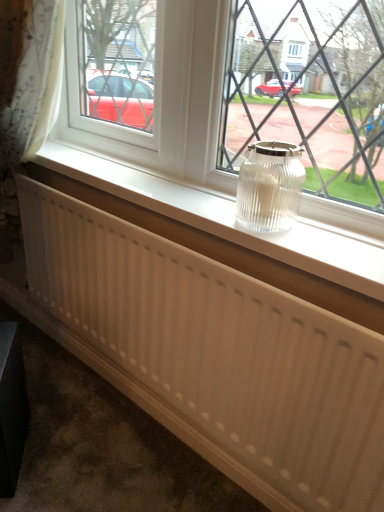
Locate an element on the screen. vacant space situated above white plastic radiator at center (from a real-world perspective) is located at coordinates (176, 192).